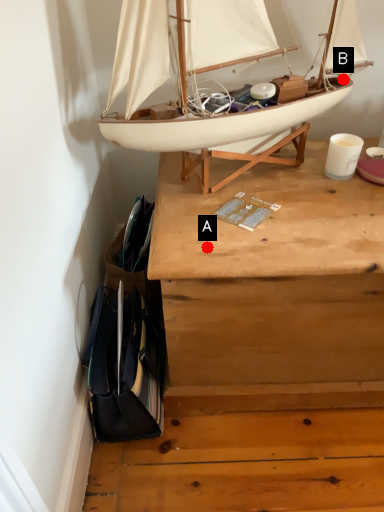
Question: Two points are circled on the image, labeled by A and B beside each circle. Which point is closer to the camera?

Choices:
 (A) A is closer
 (B) B is closer

Answer: (A)